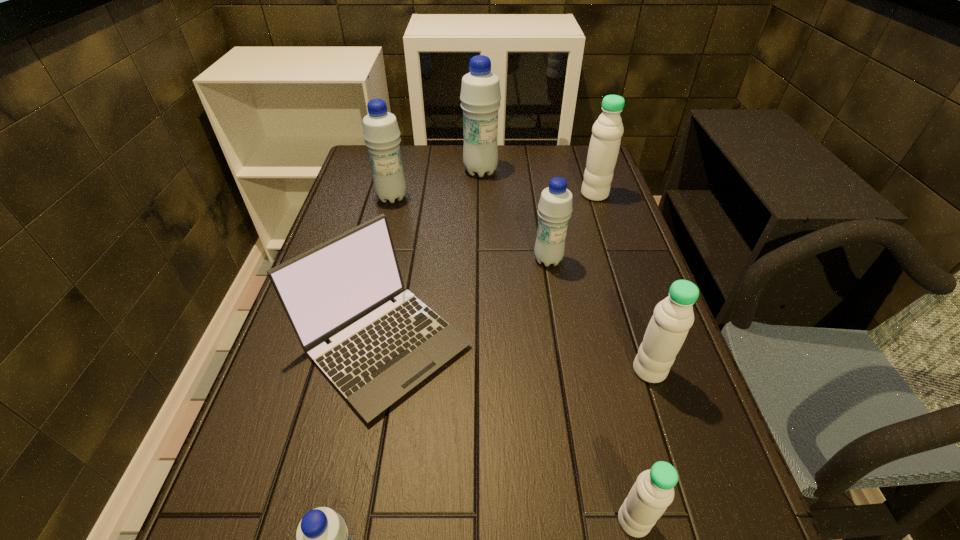
In order to click on the fifth closest object to the nearest blue water bottle in this screenshot , I will do `click(381, 133)`.

You are a GUI agent. You are given a task and a screenshot of the screen. Output one action in this format:
    pyautogui.click(x=<x>, y=<y>)
    Task: Click on the fifth closest object to the sixth object from left to right
    
    Given the screenshot: What is the action you would take?
    pyautogui.click(x=607, y=131)

Where is `water bottle that stands as the fifth closest to the third nearest water bottle`? water bottle that stands as the fifth closest to the third nearest water bottle is located at coordinates tap(480, 96).

Image resolution: width=960 pixels, height=540 pixels. I want to click on water bottle that can be found as the sixth closest to the third smallest blue water bottle, so click(x=653, y=491).

The width and height of the screenshot is (960, 540). Identify the location of blue water bottle that is the second closest to the nearest water bottle. (381, 133).

Select which blue water bottle is the closest to the third smallest blue water bottle. Please provide its 2D coordinates. Your answer should be formatted as a tuple, i.e. [(x, y)], where the tuple contains the x and y coordinates of a point satisfying the conditions above.

[(480, 96)]

Identify which white water bottle is located as the second nearest to the biggest blue water bottle. Please provide its 2D coordinates. Your answer should be formatted as a tuple, i.e. [(x, y)], where the tuple contains the x and y coordinates of a point satisfying the conditions above.

[(673, 317)]

The width and height of the screenshot is (960, 540). I want to click on the second closest white water bottle to the second nearest blue water bottle, so click(673, 317).

Where is `free location that satisfies the following two spatial constraints: 1. on the back side of the third smallest blue water bottle; 2. on the right side of the biggest white water bottle`? free location that satisfies the following two spatial constraints: 1. on the back side of the third smallest blue water bottle; 2. on the right side of the biggest white water bottle is located at coordinates (393, 194).

Find the location of a particular element. free space that satisfies the following two spatial constraints: 1. at the front screen of the laptop_computer; 2. on the left side of the leftmost white water bottle is located at coordinates pyautogui.click(x=349, y=521).